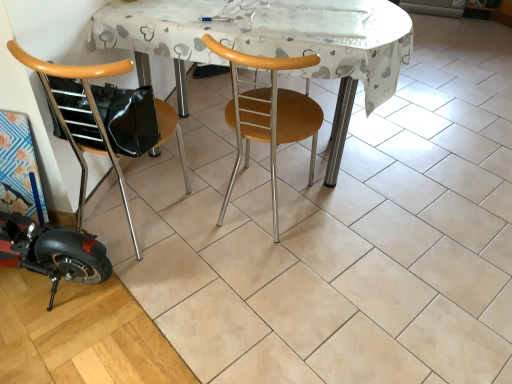
The width and height of the screenshot is (512, 384). What do you see at coordinates (104, 118) in the screenshot? I see `woodenchair at left, positioned as the first chair in left-to-right order` at bounding box center [104, 118].

In order to face white plastic table at center, should I rotate leftwards or rightwards?

Turn right by 1.783 degrees to look at white plastic table at center.

Image resolution: width=512 pixels, height=384 pixels. Describe the element at coordinates (268, 115) in the screenshot. I see `woodenwoodenchair at center, which is the first chair from right to left` at that location.

Identify the location of woodenchair at left, positioned as the first chair in left-to-right order. This screenshot has width=512, height=384. (104, 118).

You are a GUI agent. You are given a task and a screenshot of the screen. Output one action in this format:
    pyautogui.click(x=<x>, y=<y>)
    Task: Click on the chair to the right of woodenchair at left, positioned as the first chair in left-to-right order
    Image resolution: width=512 pixels, height=384 pixels.
    Given the screenshot: What is the action you would take?
    pyautogui.click(x=268, y=115)

From a real-world perspective, who is located lower, woodenwoodenchair at center, which is the first chair from right to left, or woodenchair at left, positioned as the first chair in left-to-right order?

woodenwoodenchair at center, which is the first chair from right to left, from a real-world perspective.

Is woodenwoodenchair at center, which is the first chair from right to left, aimed at woodenchair at left, positioned as the first chair in left-to-right order?

No, woodenwoodenchair at center, which is the first chair from right to left, is not facing towards woodenchair at left, positioned as the first chair in left-to-right order.

Which object is further away from the camera taking this photo, woodenwoodenchair at center, which is the first chair from right to left, or white plastic table at center?

white plastic table at center is more distant.

Can you confirm if woodenwoodenchair at center, which is the first chair from right to left, is bigger than white plastic table at center?

No, woodenwoodenchair at center, which is the first chair from right to left, is not bigger than white plastic table at center.

Which of these two, woodenwoodenchair at center, which ranks as the second chair in left-to-right order, or white plastic table at center, stands shorter?

With less height is white plastic table at center.

Is point (94, 31) positioned before point (316, 124)?

Yes, it is in front of point (316, 124).

Is white plastic table at center next to woodenwoodenchair at center, which ranks as the second chair in left-to-right order?

No, white plastic table at center is not next to woodenwoodenchair at center, which ranks as the second chair in left-to-right order.

From the image's perspective, is white plastic table at center below woodenwoodenchair at center, which is the first chair from right to left?

No, from the image's perspective, white plastic table at center is not below woodenwoodenchair at center, which is the first chair from right to left.

From a real-world perspective, is white plastic table at center positioned under woodenwoodenchair at center, which ranks as the second chair in left-to-right order, based on gravity?

Yes.

Is woodenchair at left, positioned as the 2th chair in right-to-left order, located outside woodenwoodenchair at center, which ranks as the second chair in left-to-right order?

That's correct, woodenchair at left, positioned as the 2th chair in right-to-left order, is outside of woodenwoodenchair at center, which ranks as the second chair in left-to-right order.

Consider the image. Which object is positioned more to the left, woodenchair at left, positioned as the first chair in left-to-right order, or woodenwoodenchair at center, which ranks as the second chair in left-to-right order?

Positioned to the left is woodenchair at left, positioned as the first chair in left-to-right order.

Which is less distant, (x=123, y=146) or (x=250, y=57)?

The point (x=123, y=146) is closer.

Can you tell me how much white plastic table at center and woodenchair at left, positioned as the 2th chair in right-to-left order, differ in facing direction?

The angle between the facing direction of white plastic table at center and the facing direction of woodenchair at left, positioned as the 2th chair in right-to-left order, is 176 degrees.

Is white plastic table at center next to woodenchair at left, positioned as the first chair in left-to-right order?

No, white plastic table at center is not making contact with woodenchair at left, positioned as the first chair in left-to-right order.

Is point (263, 32) less distant than point (125, 96)?

No, (263, 32) is behind (125, 96).

Considering the sizes of woodenchair at left, positioned as the first chair in left-to-right order, and white plastic table at center in the image, is woodenchair at left, positioned as the first chair in left-to-right order, wider or thinner than white plastic table at center?

In the image, woodenchair at left, positioned as the first chair in left-to-right order, appears to be more narrow than white plastic table at center.

How many degrees apart are the facing directions of woodenchair at left, positioned as the 2th chair in right-to-left order, and white plastic table at center?

The angular difference between woodenchair at left, positioned as the 2th chair in right-to-left order, and white plastic table at center is 176 degrees.

From a real-world perspective, which is physically below, woodenchair at left, positioned as the 2th chair in right-to-left order, or white plastic table at center?

From a 3D spatial view, white plastic table at center is below.

You are a GUI agent. You are given a task and a screenshot of the screen. Output one action in this format:
    pyautogui.click(x=<x>, y=<y>)
    Task: Click on the chair in front of the woodenwoodenchair at center, which ranks as the second chair in left-to-right order
    The height and width of the screenshot is (384, 512).
    Given the screenshot: What is the action you would take?
    pyautogui.click(x=104, y=118)

Where is `table located underneath the woodenwoodenchair at center, which ranks as the second chair in left-to-right order (from a real-world perspective)`? table located underneath the woodenwoodenchair at center, which ranks as the second chair in left-to-right order (from a real-world perspective) is located at coordinates (271, 43).

When comparing their distances from white plastic table at center, does woodenchair at left, positioned as the first chair in left-to-right order, or woodenwoodenchair at center, which ranks as the second chair in left-to-right order, seem closer?

The object closer to white plastic table at center is woodenwoodenchair at center, which ranks as the second chair in left-to-right order.

Which object lies further to the anchor point white plastic table at center, woodenwoodenchair at center, which is the first chair from right to left, or woodenchair at left, positioned as the first chair in left-to-right order?

The object further to white plastic table at center is woodenchair at left, positioned as the first chair in left-to-right order.

Based on their spatial positions, is white plastic table at center or woodenwoodenchair at center, which is the first chair from right to left, closer to woodenchair at left, positioned as the 2th chair in right-to-left order?

woodenwoodenchair at center, which is the first chair from right to left, is closer to woodenchair at left, positioned as the 2th chair in right-to-left order.

Estimate the real-world distances between objects in this image. Which object is further from woodenchair at left, positioned as the first chair in left-to-right order, woodenwoodenchair at center, which ranks as the second chair in left-to-right order, or white plastic table at center?

white plastic table at center.

Based on the photo, estimate the real-world distances between objects in this image. Which object is closer to woodenwoodenchair at center, which is the first chair from right to left, white plastic table at center or woodenchair at left, positioned as the first chair in left-to-right order?

white plastic table at center lies closer to woodenwoodenchair at center, which is the first chair from right to left, than the other object.

Looking at the image, which one is located closer to woodenwoodenchair at center, which is the first chair from right to left, woodenchair at left, positioned as the 2th chair in right-to-left order, or white plastic table at center?

white plastic table at center.

Image resolution: width=512 pixels, height=384 pixels. Identify the location of chair between woodenchair at left, positioned as the 2th chair in right-to-left order, and white plastic table at center, in the horizontal direction. (268, 115).